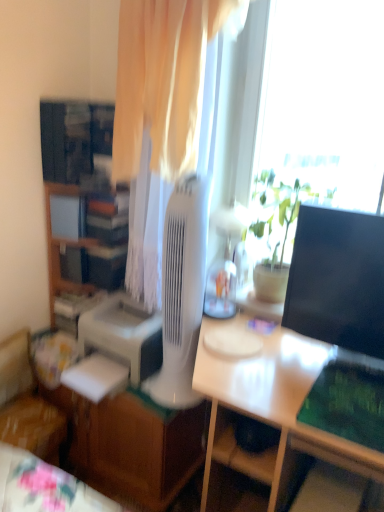
Image resolution: width=384 pixels, height=512 pixels. I want to click on free space in front of black glossy monitor at right, so click(336, 396).